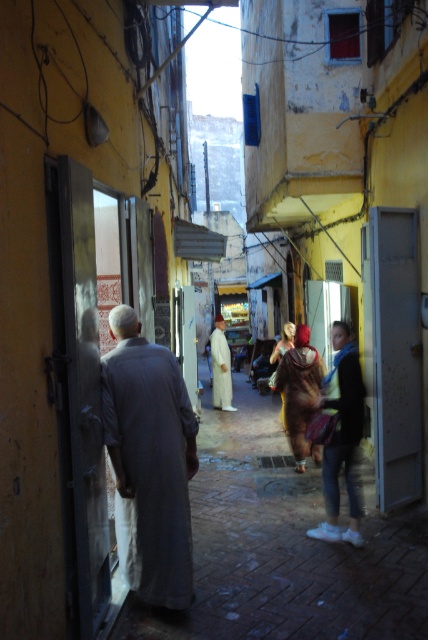
You are a delivery person carrying a package that requires a clear path of at least 5 meters between the gray cotton robe at left and the nearest wall to safely navigate through the alley. Is the distance sufficient?

The distance between the gray cotton robe at left and the nearest wall is 4.24 meters, which is less than the required 5 meters. Therefore, the path is not wide enough for safe navigation with the package.

You are a delivery person carrying a package and need to walk through the alleyway. There is a gray cotton robe at left and denim jeans at center. Which object is blocking your path more?

The gray cotton robe at left is positioned over denim jeans at center, so it is blocking your path more.

You are a delivery person trying to navigate through the narrow alleyway. You see a gray cotton robe at left and a white cotton robe at center. Which robe is closer to the left side of the alley?

The gray cotton robe at left is closer to the left side of the alley since it is positioned to the left of the white cotton robe at center.